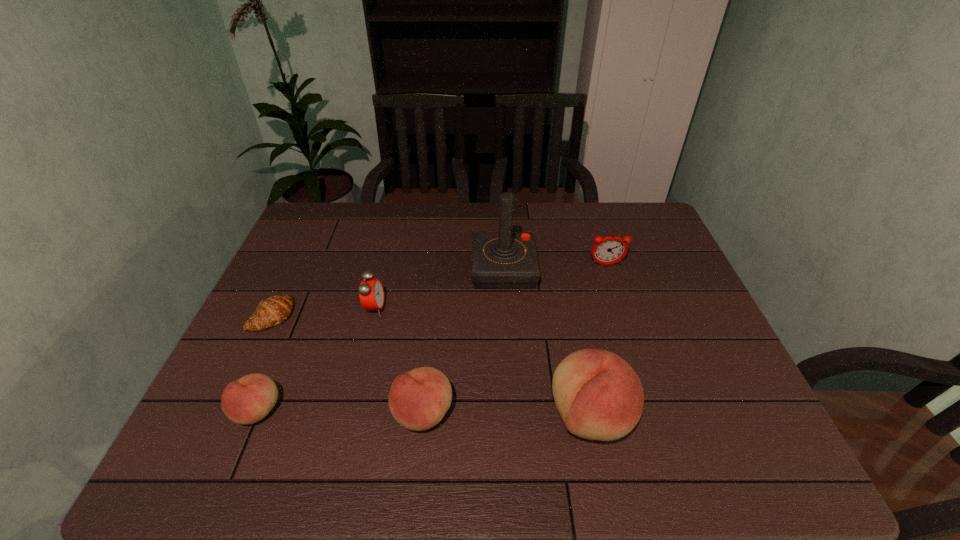
Please point a vacant point for placing a peach on the right. Please provide its 2D coordinates. Your answer should be formatted as a tuple, i.e. [(x, y)], where the tuple contains the x and y coordinates of a point satisfying the conditions above.

[(760, 418)]